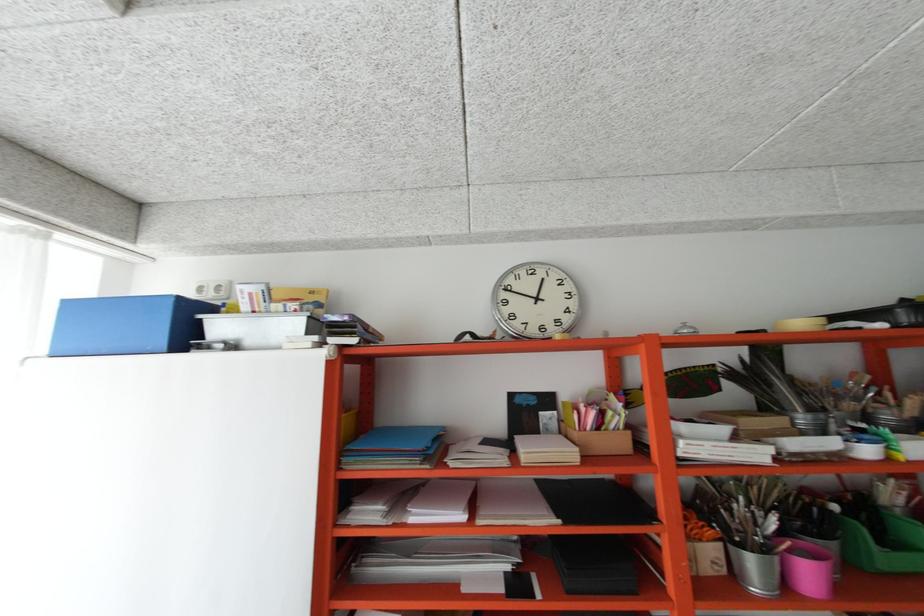
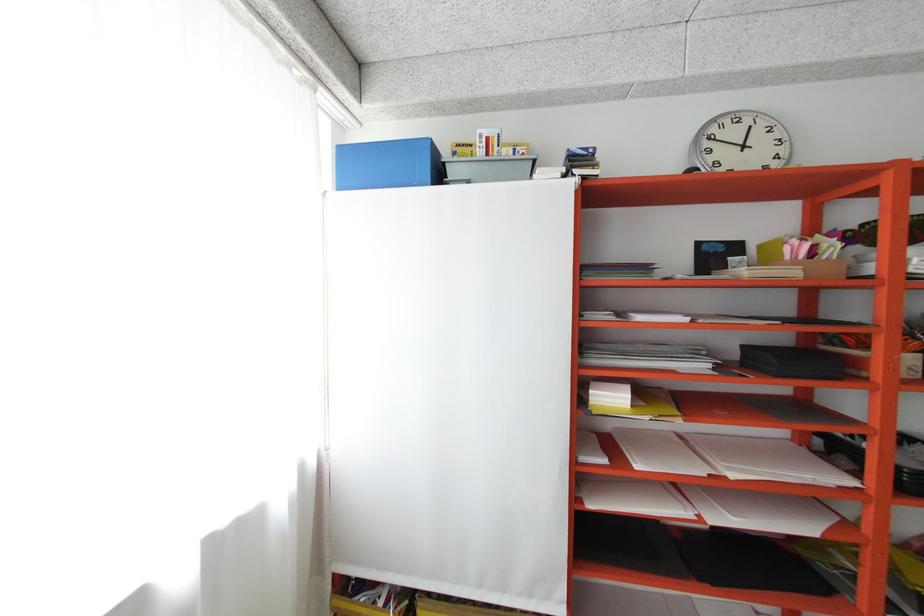
Where in the second image is the point corresponding to point 516,310 from the first image?

(720, 159)